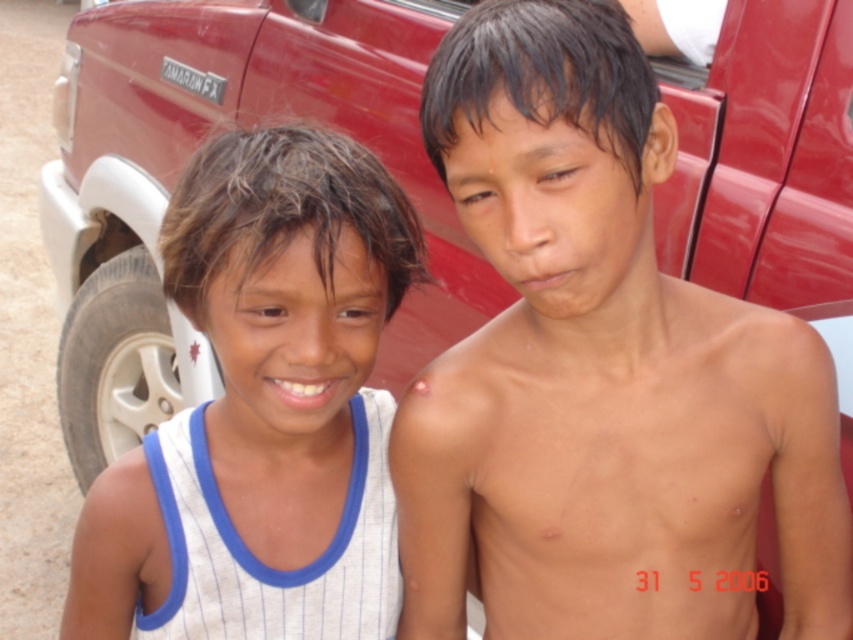
You are a photographer trying to capture both the smooth skin boy at center and the matte red truck at upper center in a single frame. Based on their sizes, which object should you focus on first to ensure both fit in the photo?

The smooth skin boy at center has a smaller size compared to the matte red truck at upper center, so you should focus on positioning the matte red truck at upper center first as it takes up more space in the frame, allowing the smaller smooth skin boy at center to fit alongside.

You are a photographer trying to capture both the smooth skin boy at center and the white striped tank top at left in a single frame. Based on their heights, which one should you adjust your camera angle to focus on first to ensure both are in the shot?

The smooth skin boy at center is much taller than the white striped tank top at left, so you should focus on the smooth skin boy at center first to ensure both are in the shot.